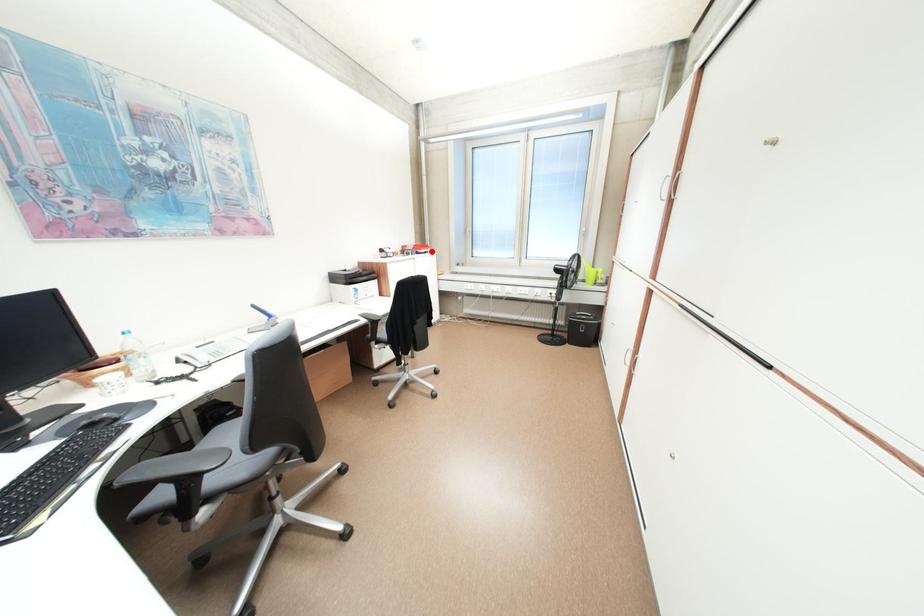
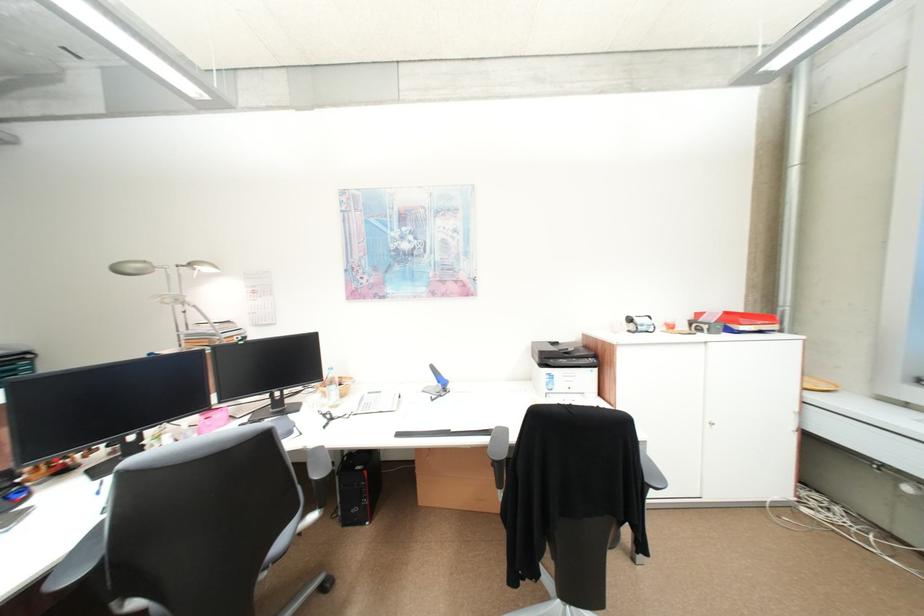
Where in the second image is the point corresponding to the highlighted location from the first image?

(754, 329)